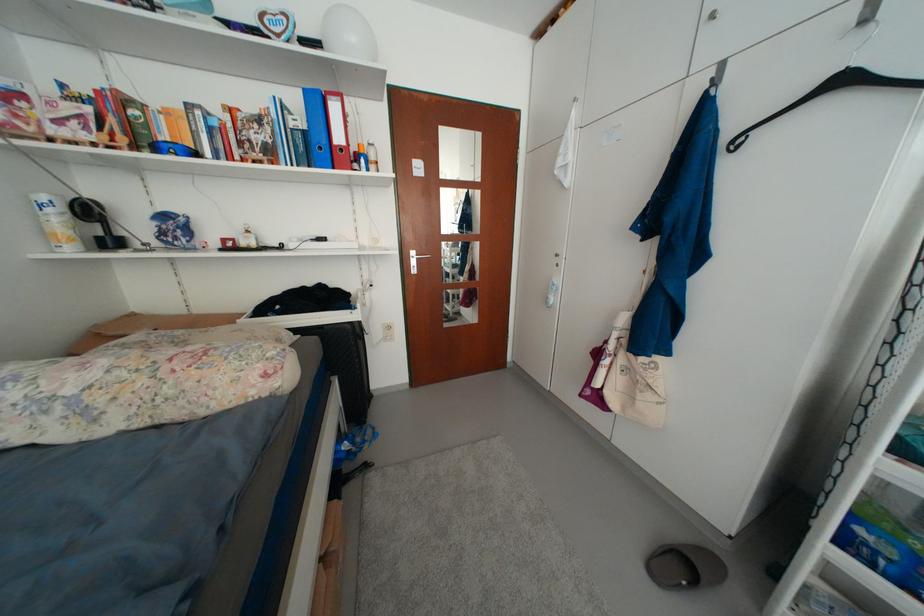
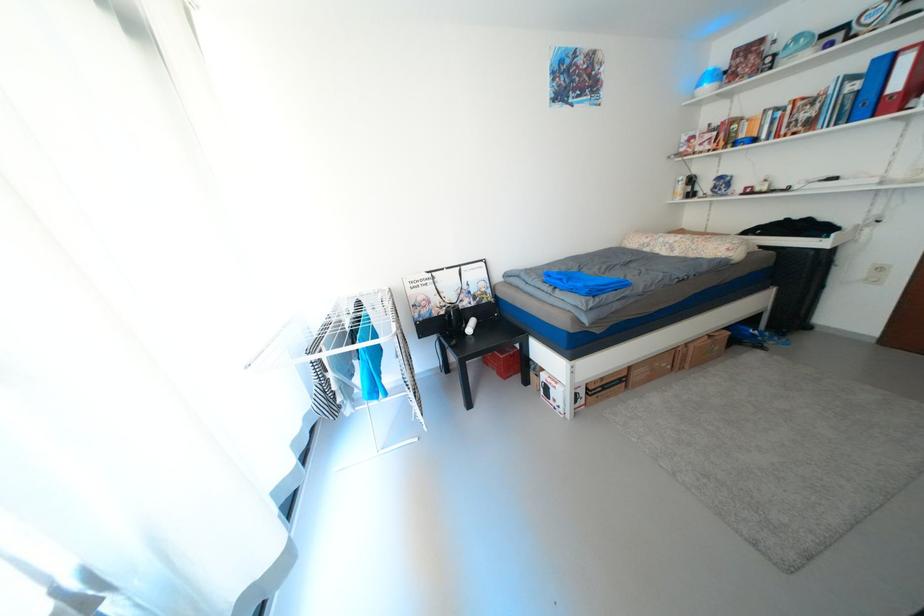
Find the pixel in the second image that matches the point at 331,562 in the first image.

(718, 338)